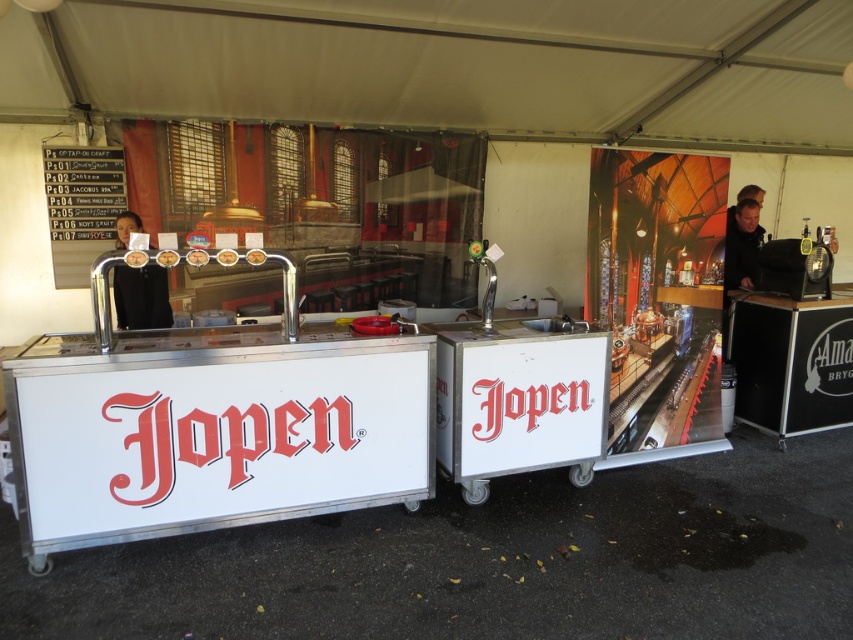
Question: Which object is closer to the camera taking this photo?

Choices:
 (A) dark brown leather jacket at upper right
 (B) black shirt at left

Answer: (B)

Question: Which point is farther to the camera?

Choices:
 (A) (146, 276)
 (B) (738, 243)

Answer: (B)

Question: Can you confirm if black shirt at left is bigger than dark brown leather jacket at upper right?

Choices:
 (A) no
 (B) yes

Answer: (B)

Question: Can you confirm if black shirt at left is bigger than dark brown leather jacket at upper right?

Choices:
 (A) yes
 (B) no

Answer: (A)

Question: Is black shirt at left above dark brown leather jacket at upper right?

Choices:
 (A) no
 (B) yes

Answer: (A)